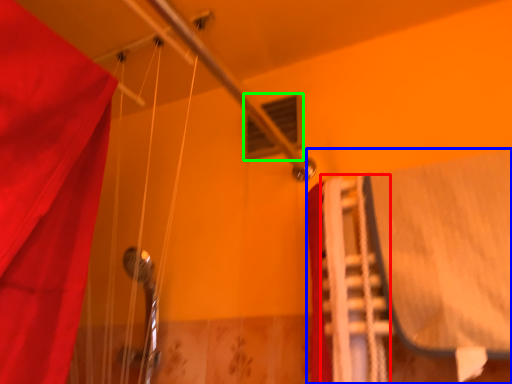
Question: Estimate the real-world distances between objects in this image. Which object is closer to stair (highlighted by a red box), bed (highlighted by a blue box) or window (highlighted by a green box)?

Choices:
 (A) bed
 (B) window

Answer: (A)